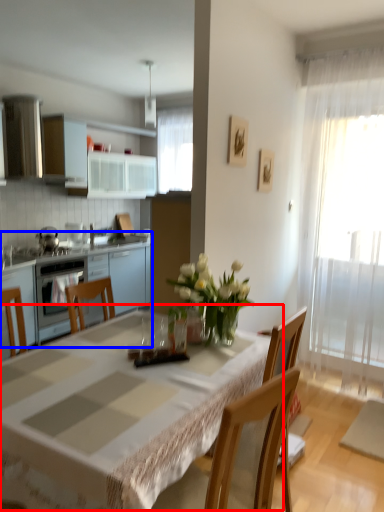
Question: Which object is closer to the camera taking this photo, table (highlighted by a red box) or cabinetry (highlighted by a blue box)?

Choices:
 (A) table
 (B) cabinetry

Answer: (A)